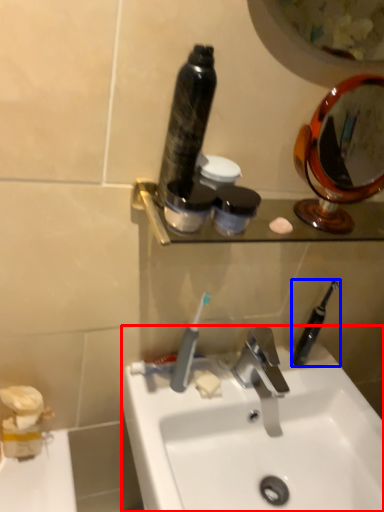
Question: Which object is further to the camera taking this photo, sink (highlighted by a red box) or toothbrush (highlighted by a blue box)?

Choices:
 (A) sink
 (B) toothbrush

Answer: (B)